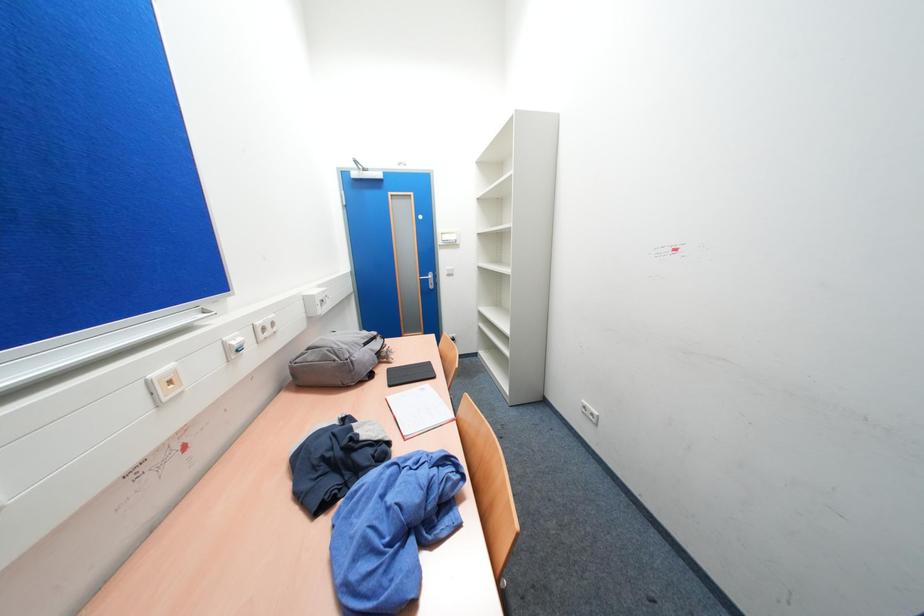
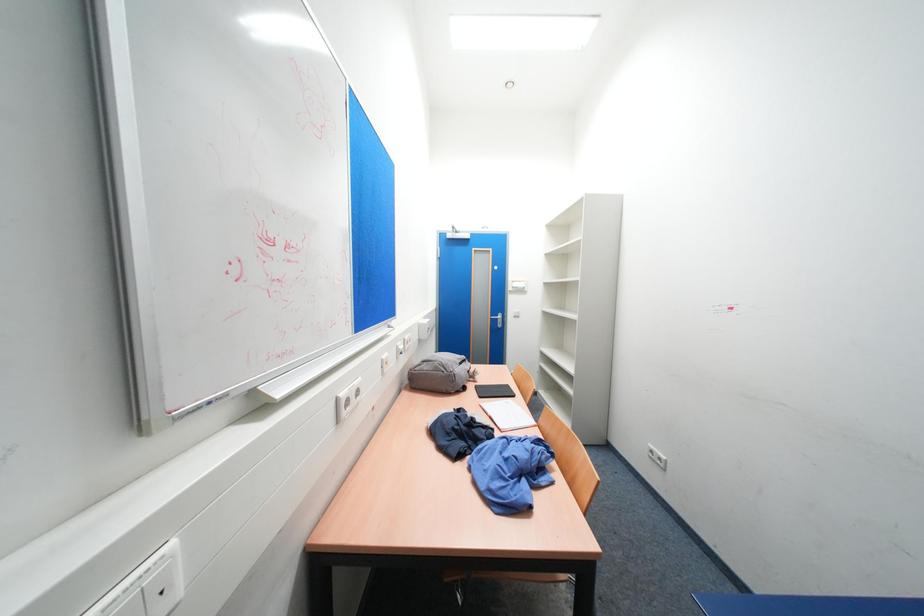
The images are taken continuously from a first-person perspective. In which direction are you moving?

The movement direction of the cameraman is left, backward.